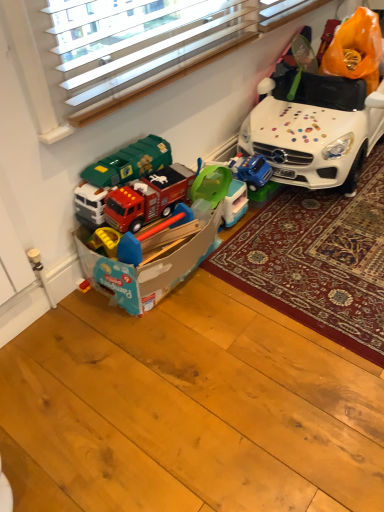
The height and width of the screenshot is (512, 384). I want to click on free location in front of green plastic toy at center, arranged as the 1th toy when viewed from the back, so click(234, 240).